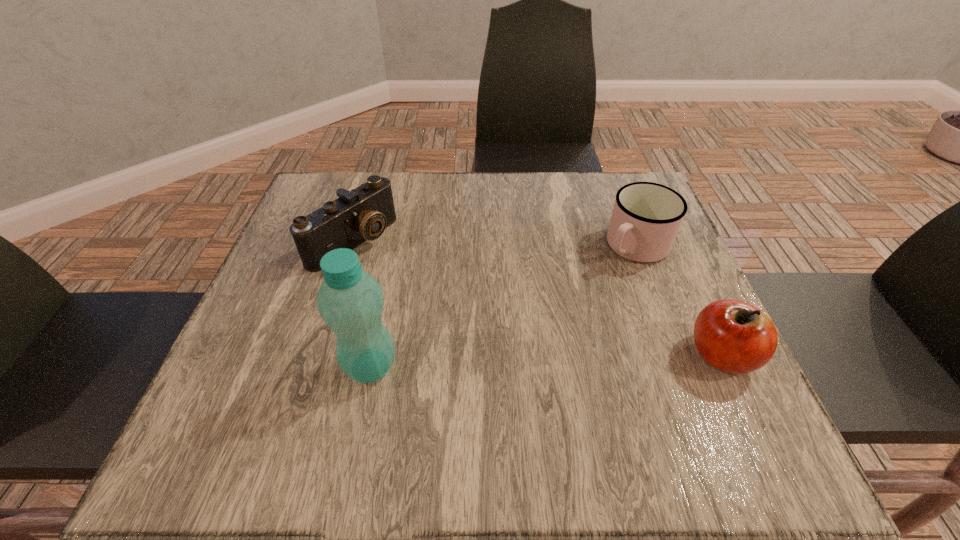
At what (x,y) coordinates should I click in order to perform the action: click on free location located 0.220m on the side of the mug with the handle. Please return your answer as a coordinate pair (x, y). Looking at the image, I should click on click(555, 319).

The height and width of the screenshot is (540, 960). I want to click on free region located 0.090m on the side of the mug with the handle, so click(592, 284).

At what (x,y) coordinates should I click in order to perform the action: click on camera that is at the far edge. Please return your answer as a coordinate pair (x, y). This screenshot has width=960, height=540. Looking at the image, I should click on (362, 214).

Where is `mug located at the far edge`? The width and height of the screenshot is (960, 540). mug located at the far edge is located at coordinates pyautogui.click(x=646, y=217).

I want to click on bottle located in the near edge section of the desktop, so click(x=350, y=301).

I want to click on apple present at the near edge, so click(x=733, y=336).

You are a GUI agent. You are given a task and a screenshot of the screen. Output one action in this format:
    pyautogui.click(x=<x>, y=<y>)
    Task: Click on the object located at the left edge
    This screenshot has width=960, height=540.
    Given the screenshot: What is the action you would take?
    pyautogui.click(x=362, y=214)

Where is `apple at the right edge`? The height and width of the screenshot is (540, 960). apple at the right edge is located at coordinates (733, 336).

The height and width of the screenshot is (540, 960). Find the location of `mug present at the right edge`. mug present at the right edge is located at coordinates (646, 217).

Find the location of a particular element. This screenshot has height=540, width=960. object that is at the far left corner is located at coordinates (362, 214).